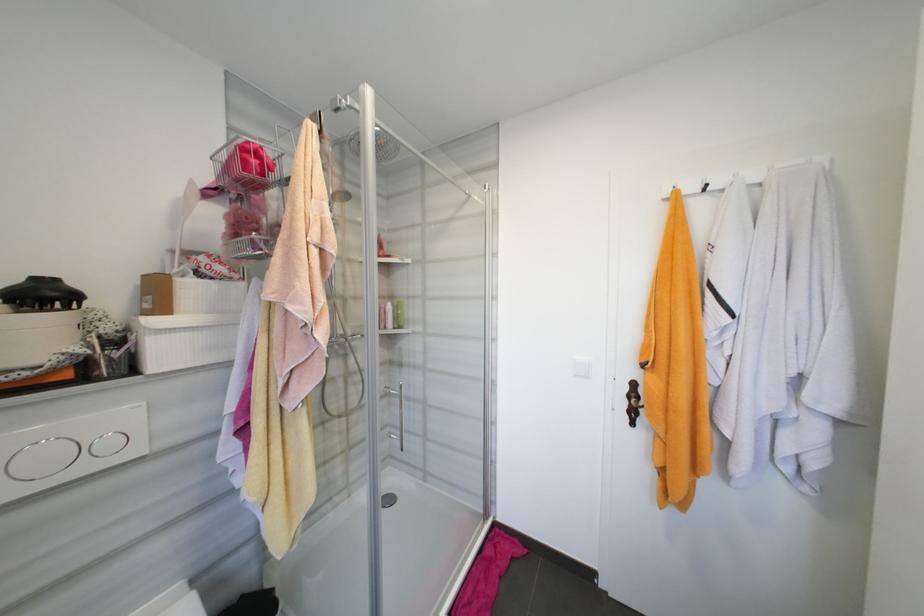
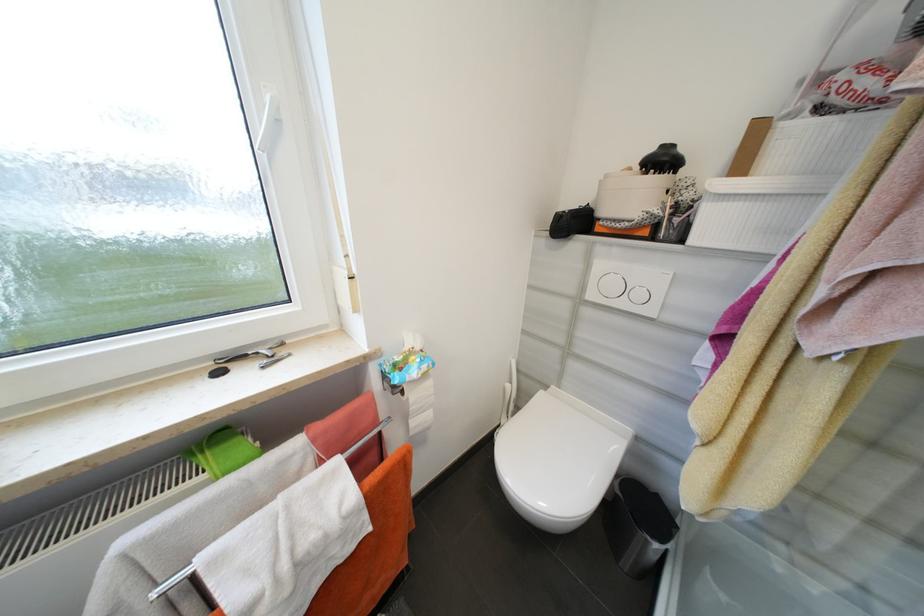
First-person continuous shooting, in which direction is the camera rotating?

The camera rotated toward left-down.